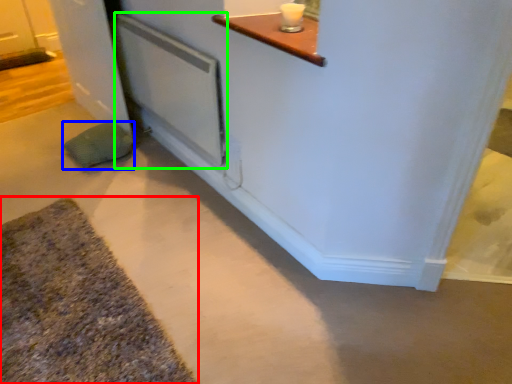
Question: Which is nearer to the bath mat (highlighted by a red box)? pillow (highlighted by a blue box) or screen door (highlighted by a green box).

Choices:
 (A) pillow
 (B) screen door

Answer: (A)